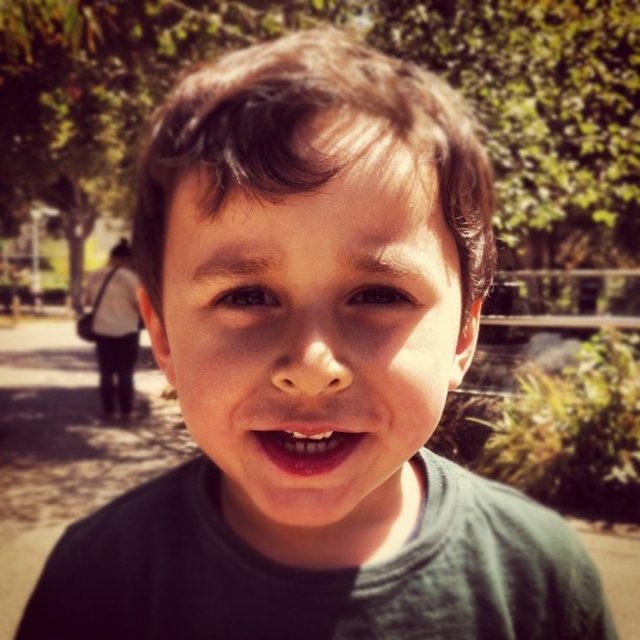
Question: Which point appears farthest from the camera in this image?

Choices:
 (A) (264, 508)
 (B) (275, 433)

Answer: (B)

Question: Can you confirm if smooth skin face at center is thinner than pink glossy lips at center?

Choices:
 (A) yes
 (B) no

Answer: (B)

Question: Does smooth skin face at center appear over pink glossy lips at center?

Choices:
 (A) no
 (B) yes

Answer: (B)

Question: Is smooth skin face at center thinner than pink glossy lips at center?

Choices:
 (A) yes
 (B) no

Answer: (B)